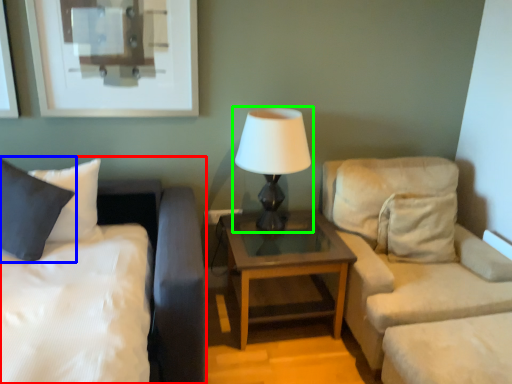
Question: Based on their relative distances, which object is farther from bed (highlighted by a red box)? Choose from pillow (highlighted by a blue box) and lamp (highlighted by a green box).

Choices:
 (A) pillow
 (B) lamp

Answer: (B)